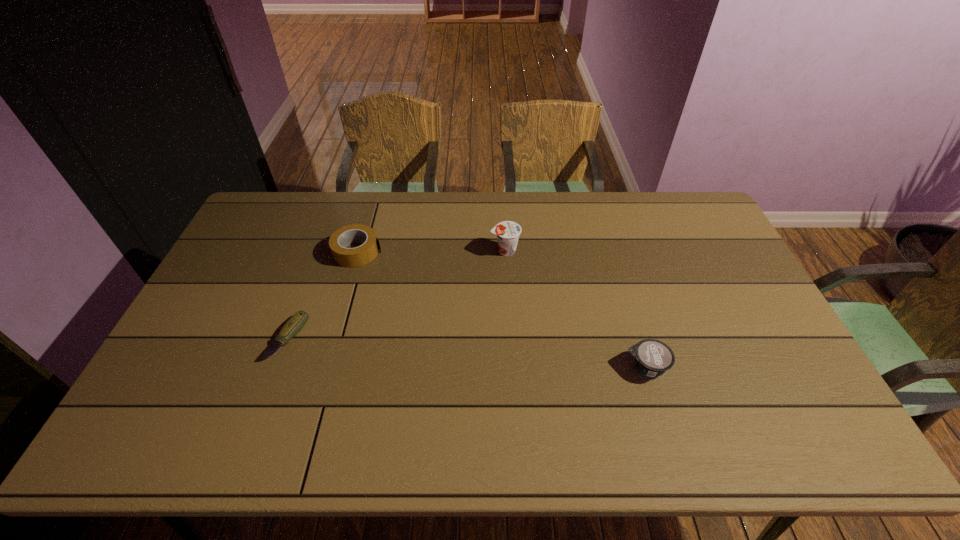
What are the coordinates of `free point located 0.240m on the front of the leftmost object` in the screenshot? It's located at (246, 451).

You are a GUI agent. You are given a task and a screenshot of the screen. Output one action in this format:
    pyautogui.click(x=<x>, y=<y>)
    Task: Click on the vacant space at the far edge of the desktop
    The image size is (960, 540).
    Given the screenshot: What is the action you would take?
    click(514, 202)

Where is `vacant area at the near edge`? This screenshot has width=960, height=540. vacant area at the near edge is located at coordinates (739, 427).

The width and height of the screenshot is (960, 540). What are the coordinates of `free region at the right edge` in the screenshot? It's located at (737, 353).

Find the location of a particular element. vacant area at the near left corner of the desktop is located at coordinates (177, 441).

You are a GUI agent. You are given a task and a screenshot of the screen. Output one action in this format:
    pyautogui.click(x=<x>, y=<y>)
    Task: Click on the vacant space at the far right corner of the desktop
    The image size is (960, 540).
    Given the screenshot: What is the action you would take?
    pyautogui.click(x=670, y=212)

I want to click on empty location between the farther yogurt and the shorter yogurt, so click(576, 309).

The height and width of the screenshot is (540, 960). I want to click on free space between the farther yogurt and the right yogurt, so click(576, 309).

Where is `free space between the tallest object and the nearer yogurt`? This screenshot has height=540, width=960. free space between the tallest object and the nearer yogurt is located at coordinates (576, 309).

The height and width of the screenshot is (540, 960). What are the coordinates of `empty space that is in between the farther yogurt and the pocketknife` in the screenshot? It's located at (396, 294).